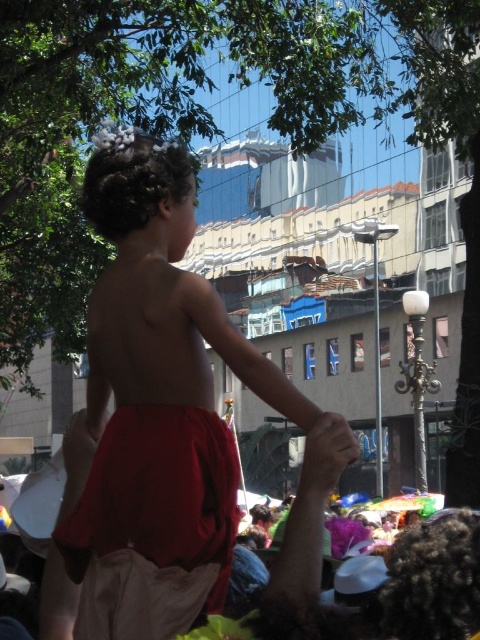
Question: Does red cotton shorts at center have a lesser width compared to smooth skin hand at center?

Choices:
 (A) yes
 (B) no

Answer: (B)

Question: Which point is closer to the camera?

Choices:
 (A) (72, 500)
 (B) (347, 429)
 (C) (126, 259)

Answer: (B)

Question: Is red fabric at center above smooth skin hand at center?

Choices:
 (A) no
 (B) yes

Answer: (A)

Question: Among these points, which one is nearest to the camera?

Choices:
 (A) (215, 340)
 (B) (418, 612)

Answer: (B)

Question: Which of the following is the farthest from the observer?

Choices:
 (A) red fabric at center
 (B) smooth skin hand at center
 (C) red cotton shorts at center

Answer: (C)

Question: Is red cotton shorts at center wider than smooth skin hand at center?

Choices:
 (A) yes
 (B) no

Answer: (A)